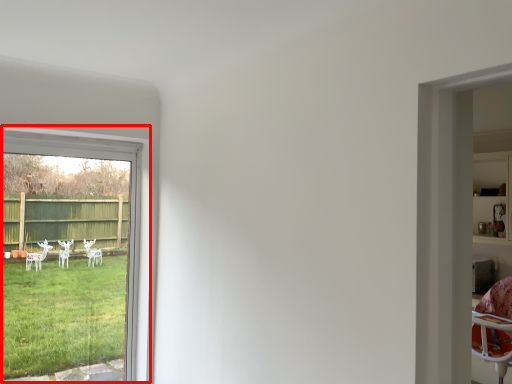
Question: From the image's perspective, considering the relative positions of window (annotated by the red box) and shelf in the image provided, where is window (annotated by the red box) located with respect to the staircase?

Choices:
 (A) above
 (B) below

Answer: (B)